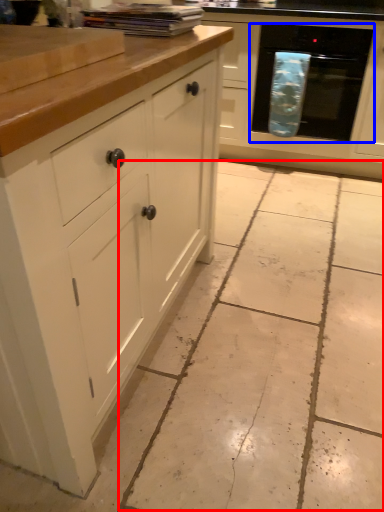
Question: Which object is further to the camera taking this photo, concrete (highlighted by a red box) or oven (highlighted by a blue box)?

Choices:
 (A) concrete
 (B) oven

Answer: (B)